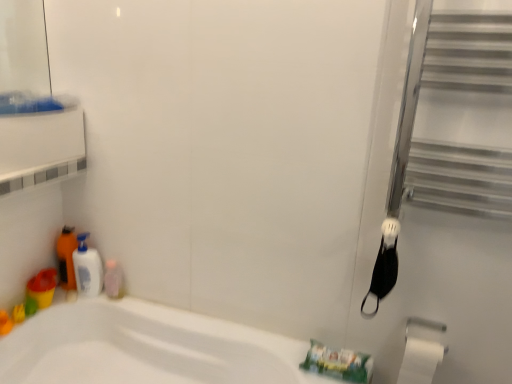
Question: From the image's perspective, is black matte screen door at right positioned above or below translucent plastic bottle at lower left, placed as the 2th toiletry when sorted from right to left?

Choices:
 (A) above
 (B) below

Answer: (A)

Question: Which is correct: black matte screen door at right is inside translucent plastic bottle at lower left, marked as the first toiletry in a left-to-right arrangement, or outside of it?

Choices:
 (A) inside
 (B) outside

Answer: (B)

Question: Considering the real-world distances, which object is closest to the white matte toilet paper at lower right?

Choices:
 (A) pink glossy bottle at lower left, which ranks as the 1th toiletry in right-to-left order
 (B) silver metallic towel bar at lower right
 (C) white glossy bottle at left
 (D) translucent plastic cup at lower left
 (E) black matte screen door at right

Answer: (B)

Question: Which object is positioned closest to the white matte toilet paper at lower right?

Choices:
 (A) translucent plastic bottle at lower left, placed as the 2th toiletry when sorted from right to left
 (B) black matte screen door at right
 (C) white glossy bottle at left
 (D) pink glossy bottle at lower left, which ranks as the 1th toiletry in right-to-left order
 (E) translucent plastic cup at lower left

Answer: (B)